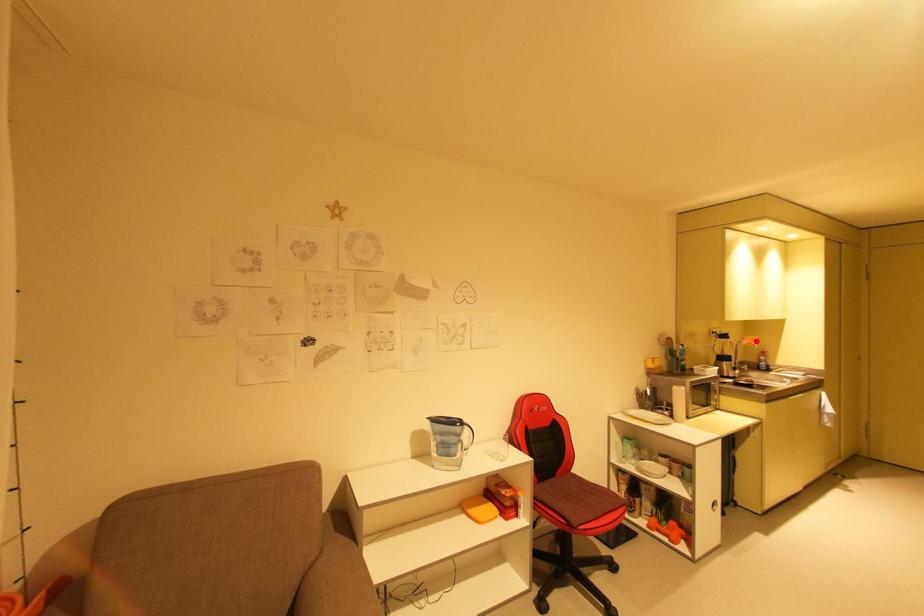
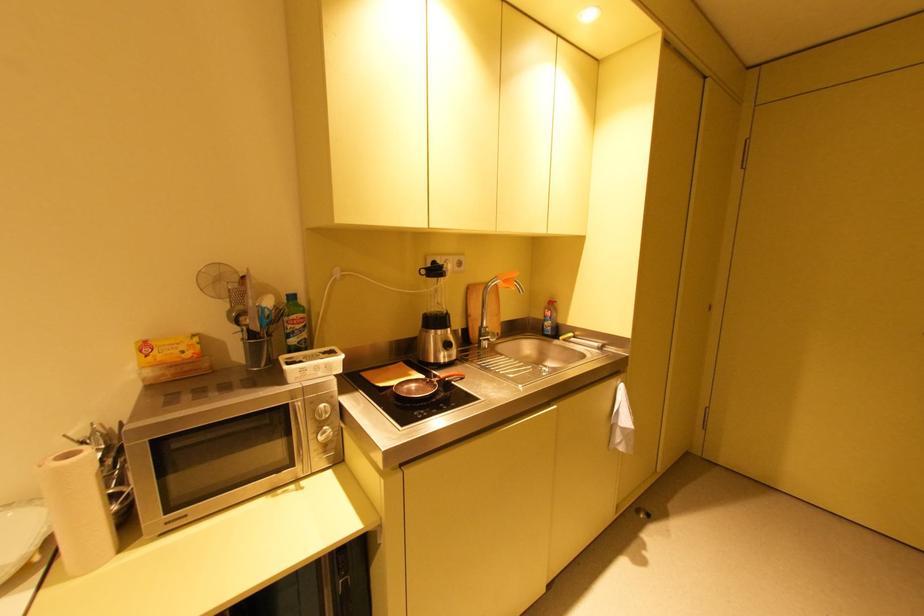
Find the pixel in the second image that matches the highlighted location in the first image.

(508, 282)